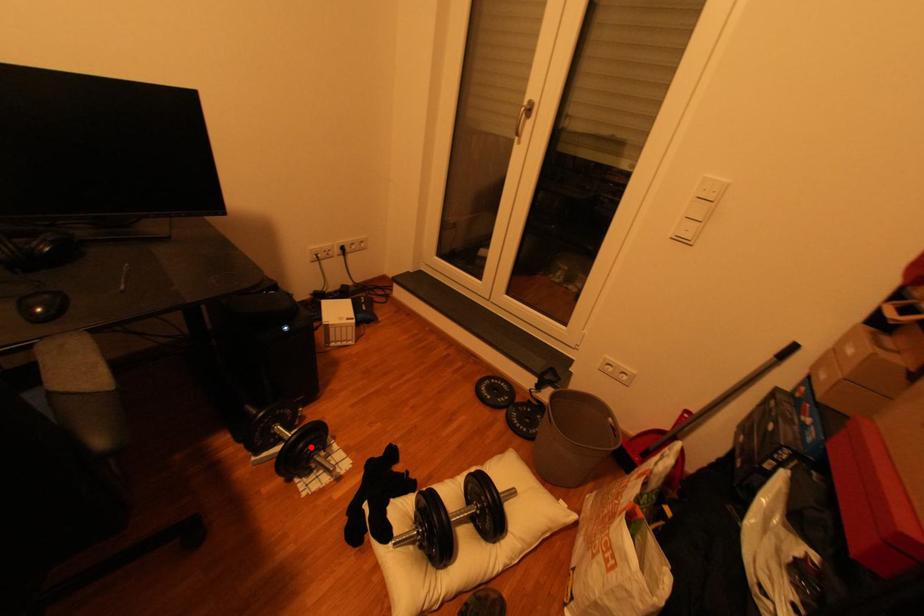
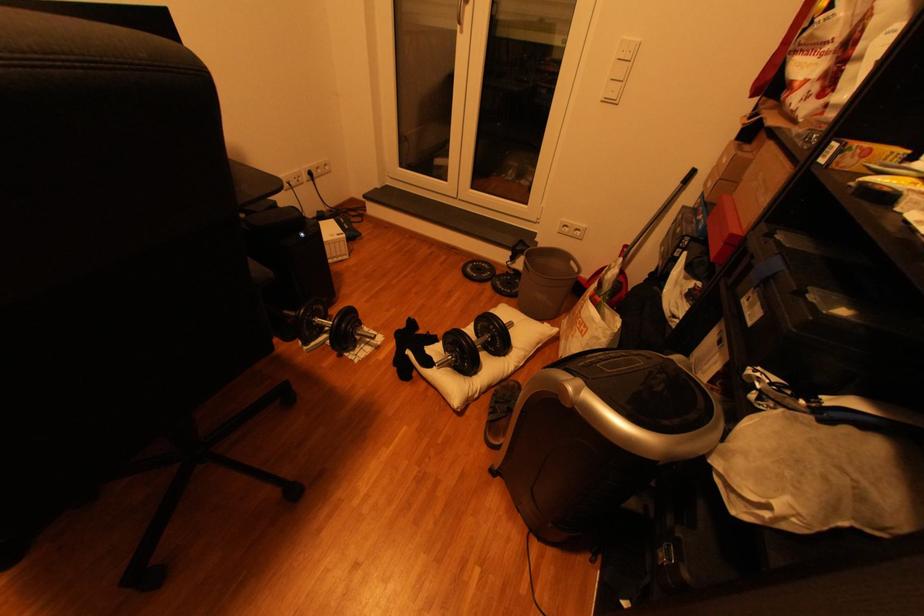
Locate, in the second image, the point that corresponds to the highlighted location in the first image.

(354, 326)